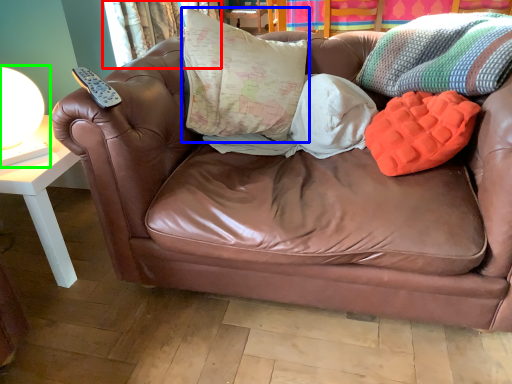
Question: Estimate the real-world distances between objects in this image. Which object is closer to curtain (highlighted by a red box), pillow (highlighted by a blue box) or table lamp (highlighted by a green box)?

Choices:
 (A) pillow
 (B) table lamp

Answer: (A)